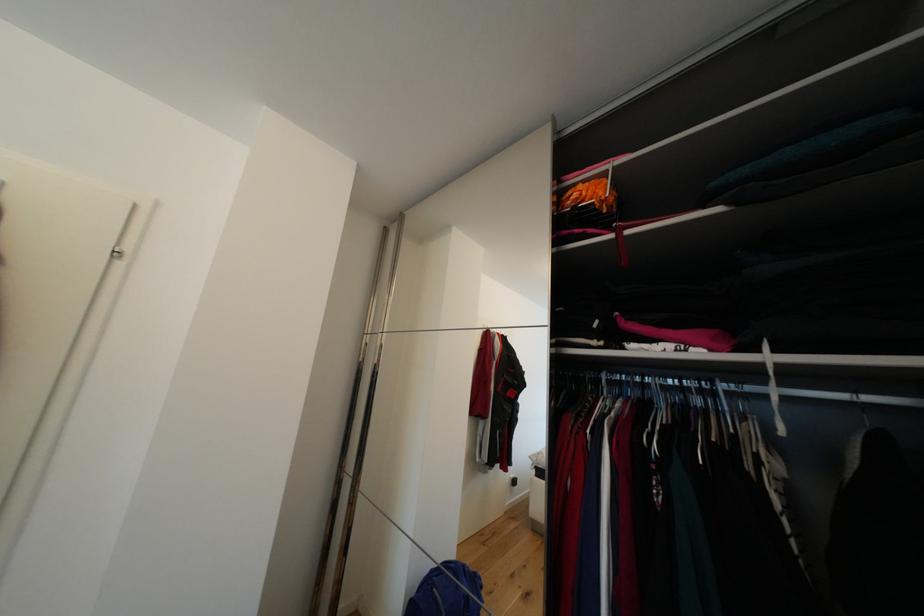
Describe the element at coordinates (357, 423) in the screenshot. The width and height of the screenshot is (924, 616). I see `the vertical metal handle` at that location.